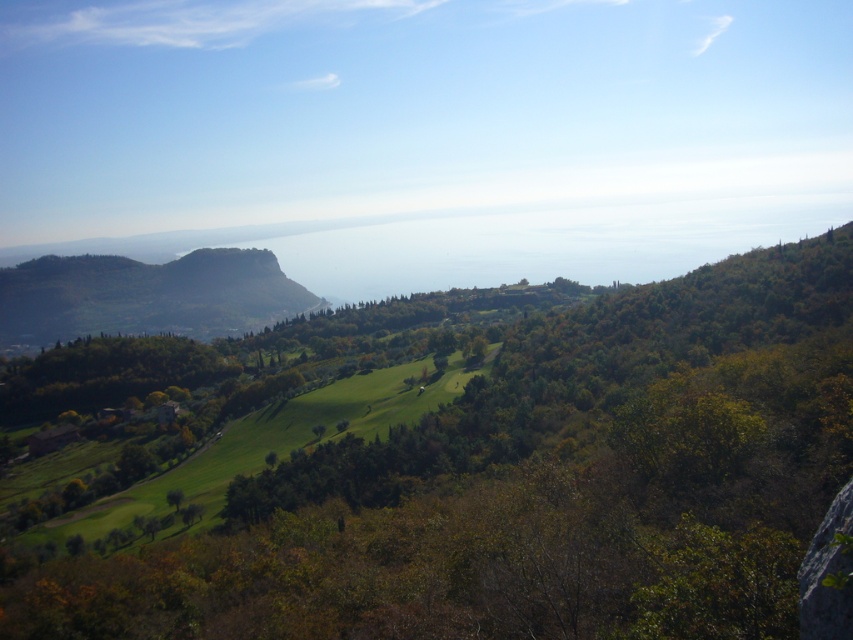
Question: Where is green leafy tree at center located in relation to green forested mountain at left in the image?

Choices:
 (A) left
 (B) right

Answer: (B)

Question: Which of the following is the farthest from the observer?

Choices:
 (A) green leafy tree at center
 (B) green forested mountain at left

Answer: (B)

Question: Does green leafy tree at center have a lesser width compared to green forested mountain at left?

Choices:
 (A) no
 (B) yes

Answer: (B)

Question: Which point appears closest to the camera in this image?

Choices:
 (A) (199, 262)
 (B) (666, 397)

Answer: (B)

Question: Does green leafy tree at center have a smaller size compared to green forested mountain at left?

Choices:
 (A) no
 (B) yes

Answer: (A)